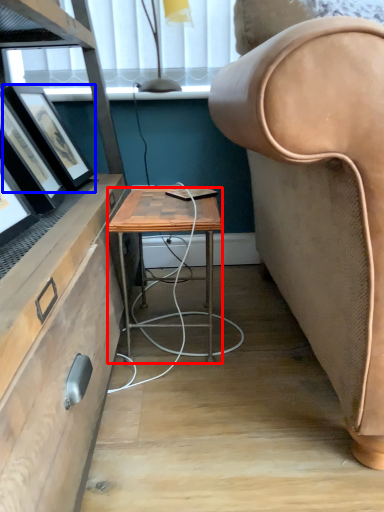
Question: Which point is further to the camera, desk (highlighted by a red box) or picture frame (highlighted by a blue box)?

Choices:
 (A) desk
 (B) picture frame

Answer: (B)